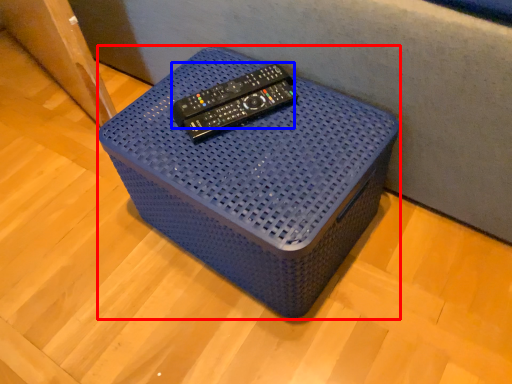
Question: Which point is closer to the camera, furniture (highlighted by a red box) or remote (highlighted by a blue box)?

Choices:
 (A) furniture
 (B) remote

Answer: (A)